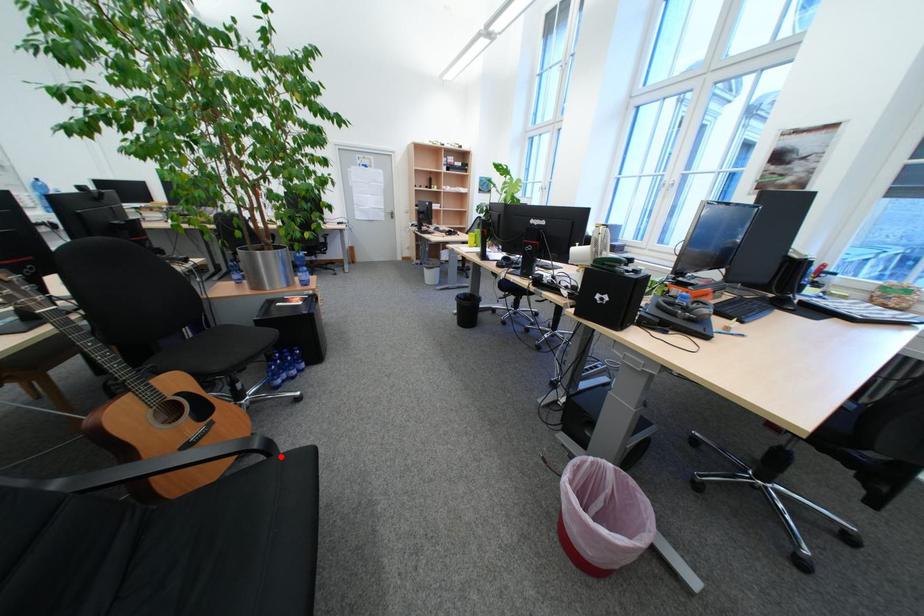
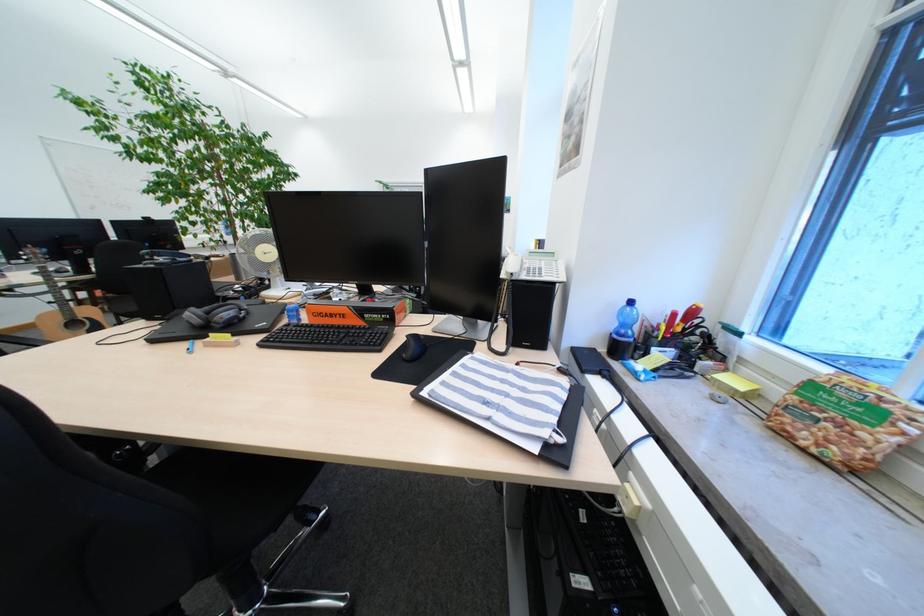
Question: I am providing you with two images of the same scene from different viewpoints. A red point is marked on the first image. Is the red point's position out of view in image 2?

Choices:
 (A) Yes
 (B) No

Answer: (A)